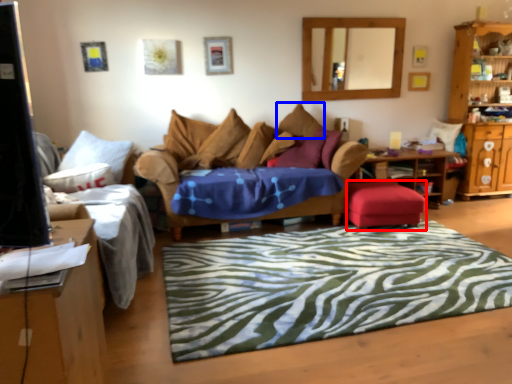
Question: Which object appears farthest to the camera in this image, stool (highlighted by a red box) or pillow (highlighted by a blue box)?

Choices:
 (A) stool
 (B) pillow

Answer: (B)